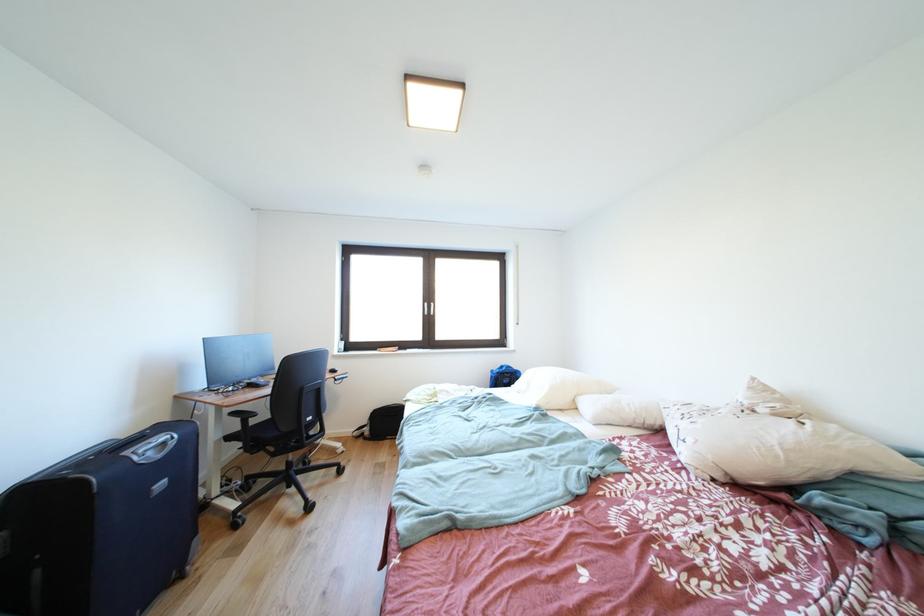
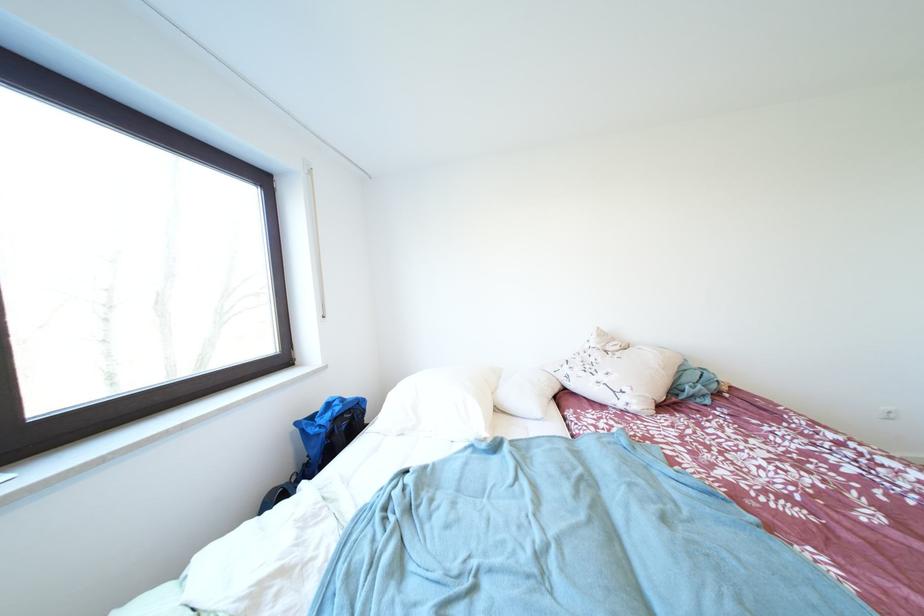
Locate, in the second image, the point that corresponds to [762,383] in the first image.

(606, 333)